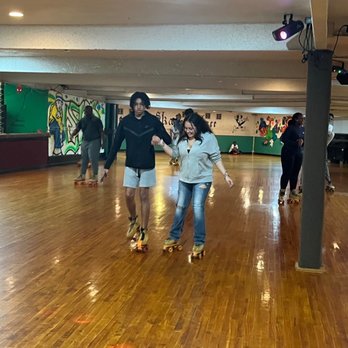
At what (x,y) coordinates should I click in order to perform the action: click on ceiling. Please return your answer as a coordinate pair (x, y). This screenshot has width=348, height=348. Looking at the image, I should click on (196, 66).